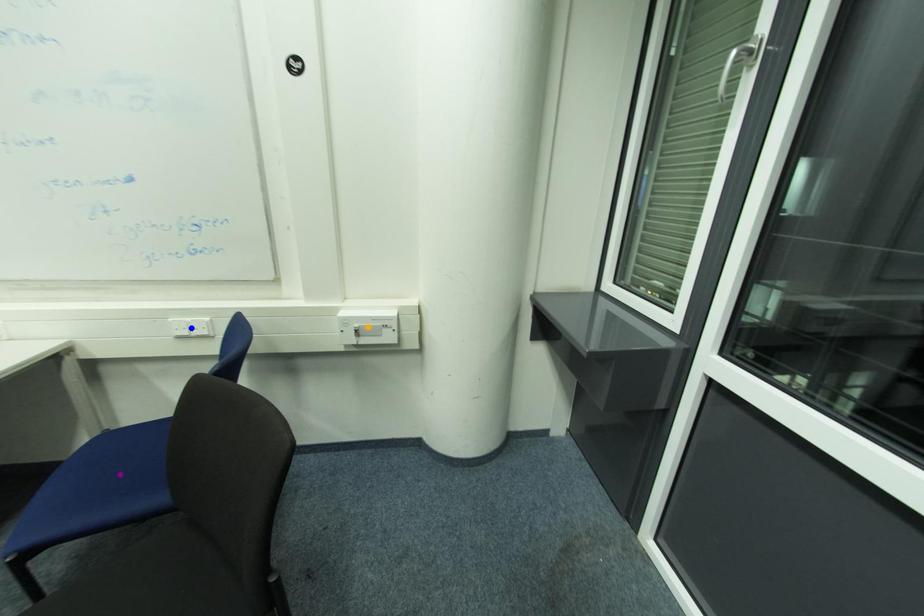
Order these from nearest to farthest:
orange point
blue point
purple point

purple point
blue point
orange point